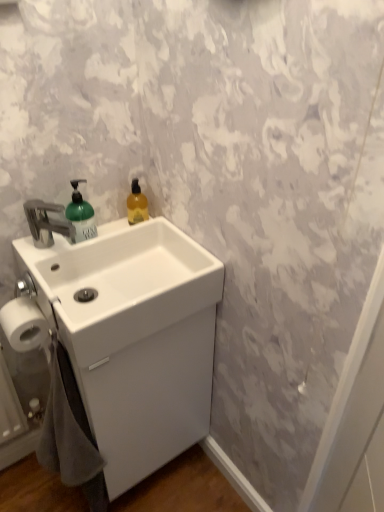
This screenshot has height=512, width=384. I want to click on free point in front of translucent amber liquid at upper right, so click(x=140, y=240).